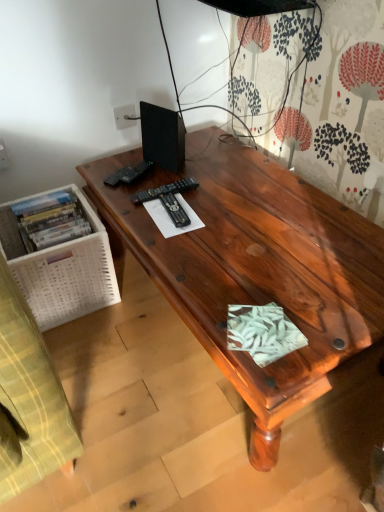
Locate an element on the screen. The height and width of the screenshot is (512, 384). blank space situated above satin wood desk at center (from a real-world perspective) is located at coordinates (243, 209).